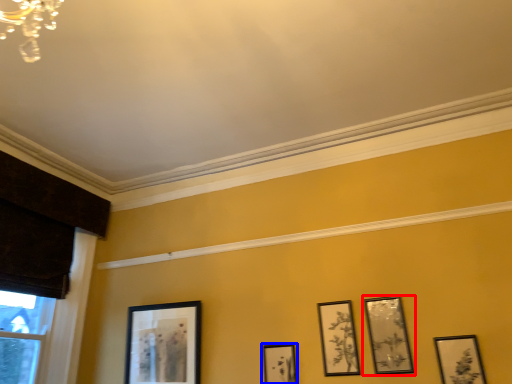
Question: Which object is further to the camera taking this photo, picture frame (highlighted by a red box) or picture frame (highlighted by a blue box)?

Choices:
 (A) picture frame
 (B) picture frame

Answer: (B)